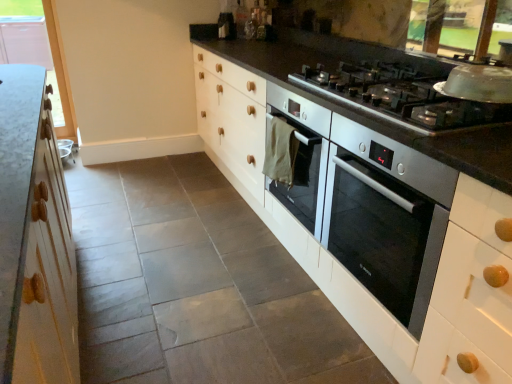
Describe the element at coordinates (372, 206) in the screenshot. The height and width of the screenshot is (384, 512). I see `satin silver oven at center-right` at that location.

The image size is (512, 384). What do you see at coordinates (400, 96) in the screenshot?
I see `satin silver gas stove at upper right` at bounding box center [400, 96].

Measure the distance between point (x=72, y=136) and camera.

The distance of point (x=72, y=136) from camera is 3.19 meters.

Find the location of `satin silver oven at center-right`. satin silver oven at center-right is located at coordinates (372, 206).

The height and width of the screenshot is (384, 512). In order to click on window that appears above the satin silver gas stove at upper right (from the image's perspective) in this screenshot , I will do `click(38, 53)`.

Is clear glass window at upper left wider than satin silver gas stove at upper right?

No, clear glass window at upper left is not wider than satin silver gas stove at upper right.

Is clear glass window at upper left completely or partially outside of satin silver gas stove at upper right?

Indeed, clear glass window at upper left is completely outside satin silver gas stove at upper right.

Which of these two, clear glass window at upper left or satin silver gas stove at upper right, stands taller?

clear glass window at upper left.

Can you confirm if satin silver gas stove at upper right is taller than satin silver oven at center-right?

In fact, satin silver gas stove at upper right may be shorter than satin silver oven at center-right.

Is satin silver gas stove at upper right not near satin silver oven at center-right?

No, satin silver gas stove at upper right is in close proximity to satin silver oven at center-right.

Does point (463, 110) come farther from viewer compared to point (329, 227)?

No, it is in front of (329, 227).

Which is behind, point (298, 199) or point (405, 76)?

The point (298, 199) is farther.

Does satin silver oven at center-right turn towards satin silver gas stove at upper right?

No, satin silver oven at center-right is not oriented towards satin silver gas stove at upper right.

Between satin silver oven at center-right and satin silver gas stove at upper right, which one has larger size?

satin silver oven at center-right.

Considering the relative positions of satin silver oven at center-right and clear glass window at upper left in the image provided, is satin silver oven at center-right to the right of clear glass window at upper left from the viewer's perspective?

Correct, you'll find satin silver oven at center-right to the right of clear glass window at upper left.

Is satin silver oven at center-right wider than clear glass window at upper left?

Yes, satin silver oven at center-right is wider than clear glass window at upper left.

From the image's perspective, relative to clear glass window at upper left, is satin silver oven at center-right above or below?

satin silver oven at center-right is below clear glass window at upper left.

Is clear glass window at upper left positioned beyond the bounds of satin silver oven at center-right?

Yes, clear glass window at upper left is outside of satin silver oven at center-right.

What are the coordinates of `home appliance on the right side of clear glass window at upper left` in the screenshot? It's located at (372, 206).

Is clear glass window at upper left bigger than satin silver oven at center-right?

No, clear glass window at upper left is not bigger than satin silver oven at center-right.

Is satin silver gas stove at upper right in contact with clear glass window at upper left?

There is a gap between satin silver gas stove at upper right and clear glass window at upper left.

Consider the image. Which of these two, satin silver gas stove at upper right or clear glass window at upper left, is smaller?

satin silver gas stove at upper right.

From a real-world perspective, does satin silver gas stove at upper right sit lower than clear glass window at upper left?

Incorrect, from a real-world perspective, satin silver gas stove at upper right is higher than clear glass window at upper left.

Where is `window beneath the satin silver gas stove at upper right (from a real-world perspective)`? window beneath the satin silver gas stove at upper right (from a real-world perspective) is located at coordinates (38, 53).

Identify the location of home appliance on the right of satin silver gas stove at upper right. (372, 206).

When comparing their distances from satin silver gas stove at upper right, does clear glass window at upper left or satin silver oven at center-right seem closer?

satin silver oven at center-right is closer to satin silver gas stove at upper right.

Which object lies further to the anchor point satin silver oven at center-right, satin silver gas stove at upper right or clear glass window at upper left?

clear glass window at upper left is further to satin silver oven at center-right.

From the image, which object appears to be nearer to satin silver gas stove at upper right, satin silver oven at center-right or clear glass window at upper left?

Based on the image, satin silver oven at center-right appears to be nearer to satin silver gas stove at upper right.

Based on their spatial positions, is satin silver oven at center-right or satin silver gas stove at upper right further from clear glass window at upper left?

Based on the image, satin silver oven at center-right appears to be further to clear glass window at upper left.

Based on their spatial positions, is clear glass window at upper left or satin silver gas stove at upper right further from satin silver oven at center-right?

clear glass window at upper left is further to satin silver oven at center-right.

When comparing their distances from clear glass window at upper left, does satin silver gas stove at upper right or satin silver oven at center-right seem further?

satin silver oven at center-right.

I want to click on gas stove between clear glass window at upper left and satin silver oven at center-right from left to right, so click(x=400, y=96).